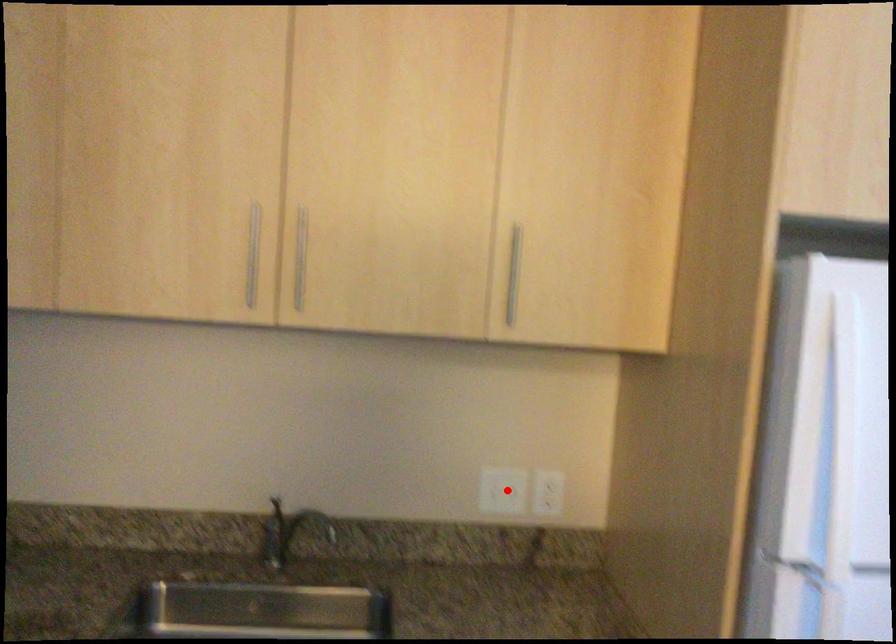
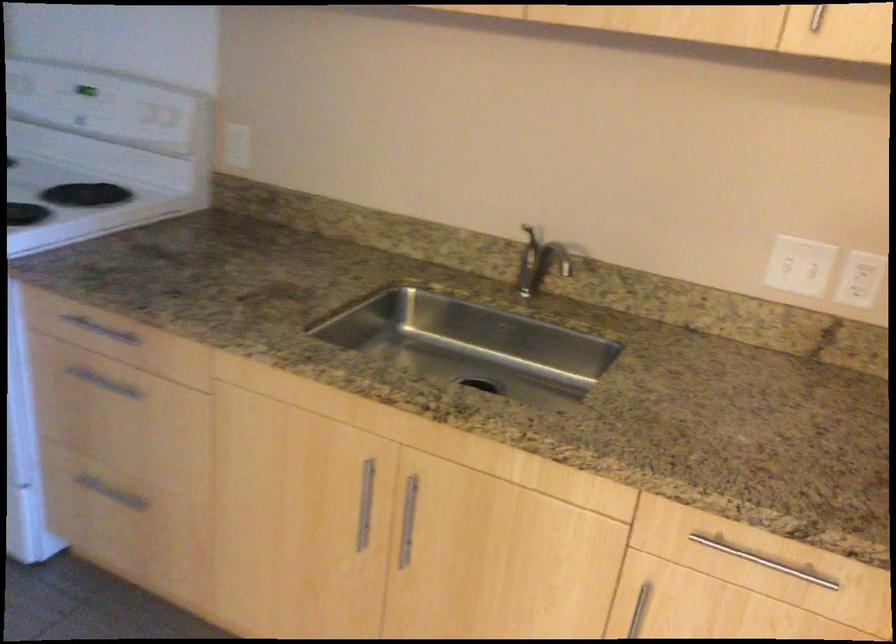
The point at the highlighted location is marked in the first image. Where is the corresponding point in the second image?

(798, 266)